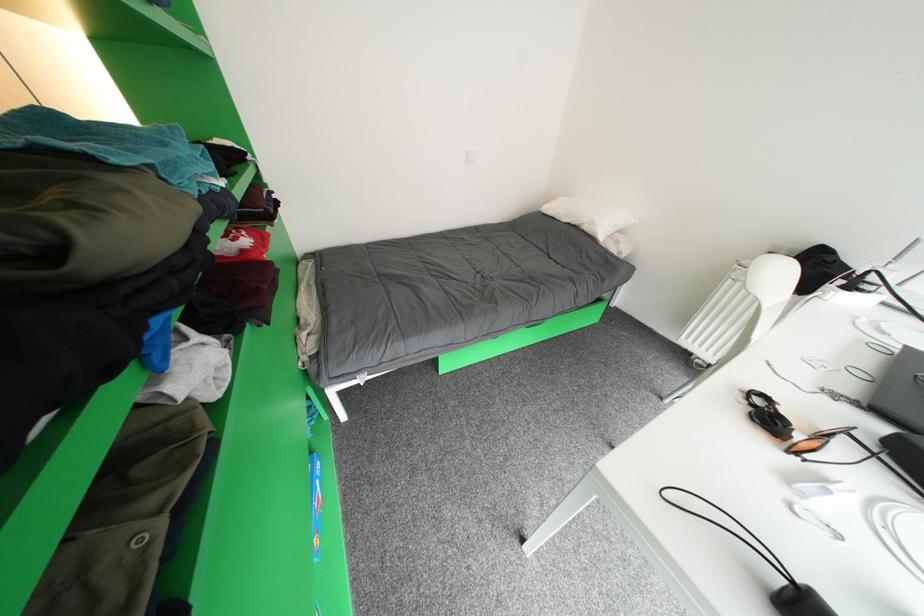
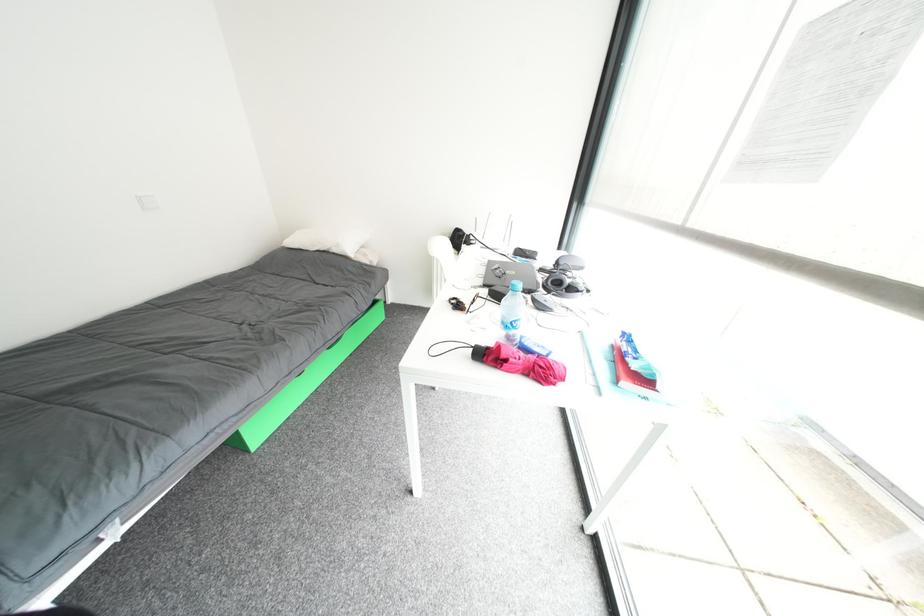
Question: The camera is either moving clockwise (left) or counter-clockwise (right) around the object. The first image is from the beginning of the video and the second image is from the end. Is the camera moving left or right when shooting the video?

Choices:
 (A) Left
 (B) Right

Answer: (A)